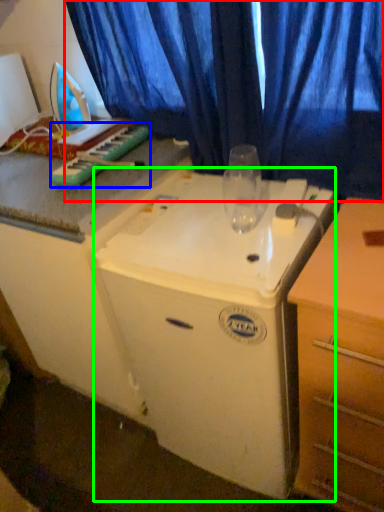
Question: Which is nearer to the curtain (highlighted by a red box)? musical keyboard (highlighted by a blue box) or appliance (highlighted by a green box).

Choices:
 (A) musical keyboard
 (B) appliance

Answer: (A)